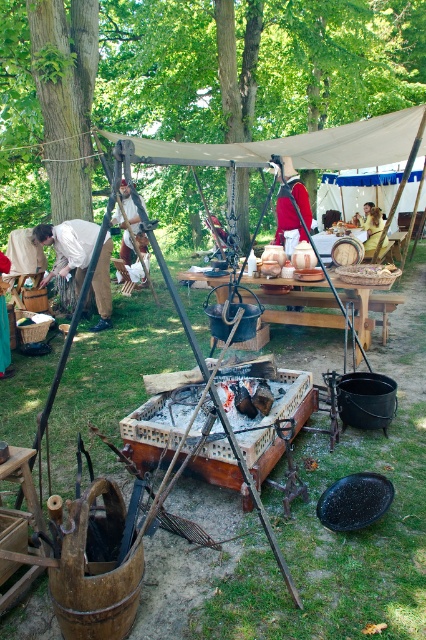
Looking at this image, who is positioned more to the left, matte white shirt at left or golden fabric bag at center?

Positioned to the left is matte white shirt at left.

Does matte white shirt at left have a greater height compared to golden fabric bag at center?

Incorrect, matte white shirt at left's height is not larger of golden fabric bag at center's.

Between point (43, 225) and point (376, 211), which one is positioned in front?

Point (43, 225)

Identify the location of matte white shirt at left. (69, 246).

Measure the distance between leather armor at center and golden fabric bag at center.

leather armor at center and golden fabric bag at center are 4.87 meters apart.

Can you confirm if leather armor at center is positioned to the left of golden fabric bag at center?

Correct, you'll find leather armor at center to the left of golden fabric bag at center.

Is point (146, 248) closer to camera compared to point (368, 224)?

Yes.

Find the location of a particular element. leather armor at center is located at coordinates (126, 224).

What do you see at coordinates (69, 246) in the screenshot? The height and width of the screenshot is (640, 426). I see `matte white shirt at left` at bounding box center [69, 246].

At what (x,y) coordinates should I click in order to perform the action: click on matte white shirt at left. Please return your answer as a coordinate pair (x, y). The image size is (426, 640). Looking at the image, I should click on (69, 246).

In order to click on matte white shirt at left in this screenshot , I will do `click(69, 246)`.